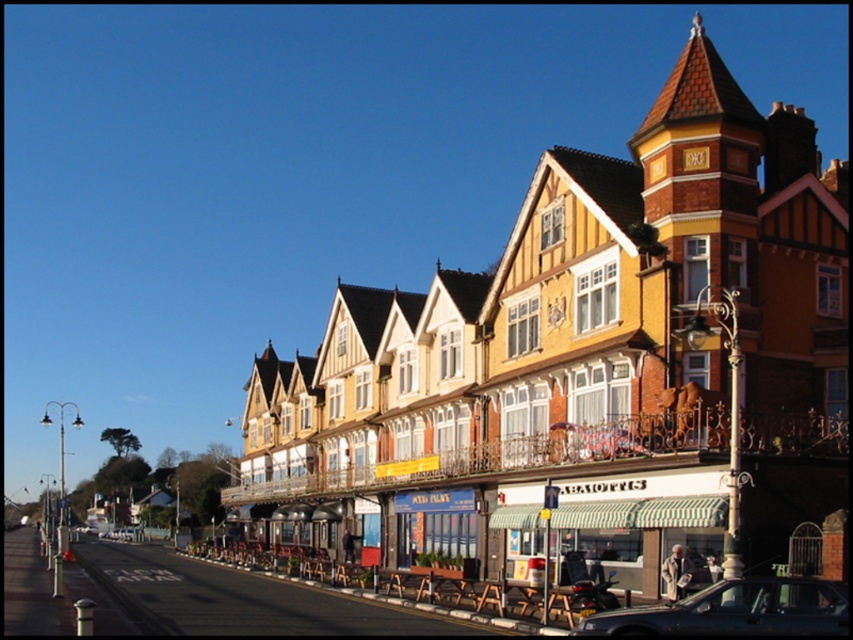
Consider the image. You are a tourist standing on the sidewalk in front of the Tudor buildings. You want to sit down but need to find the wooden benches at center. Which direction should you walk from the white striped awning at center to locate them?

The wooden benches at center are to the left of the white striped awning at center, so you should walk to the left from the white striped awning at center to find them.

You are a delivery person trying to park your van, which is 2 meters wide, in the street. There is a white striped awning at center and a metallic blue sedan at center. Can you park your van between the awning and the sedan without hitting either?

The white striped awning at center is positioned over metallic blue sedan at center, meaning there is no space between them. Therefore, you cannot park your van between the awning and the sedan as there is insufficient space.

You are a delivery person trying to park your van on the street in front of the Tudor buildings. The van requires a space that is at least as wide as the wooden benches at center. Is the space under the white striped awning at center wide enough?

The white striped awning at center is smaller than the wooden benches at center, so the space under the white striped awning at center is narrower than the required width for the van. Therefore, the van cannot park there.